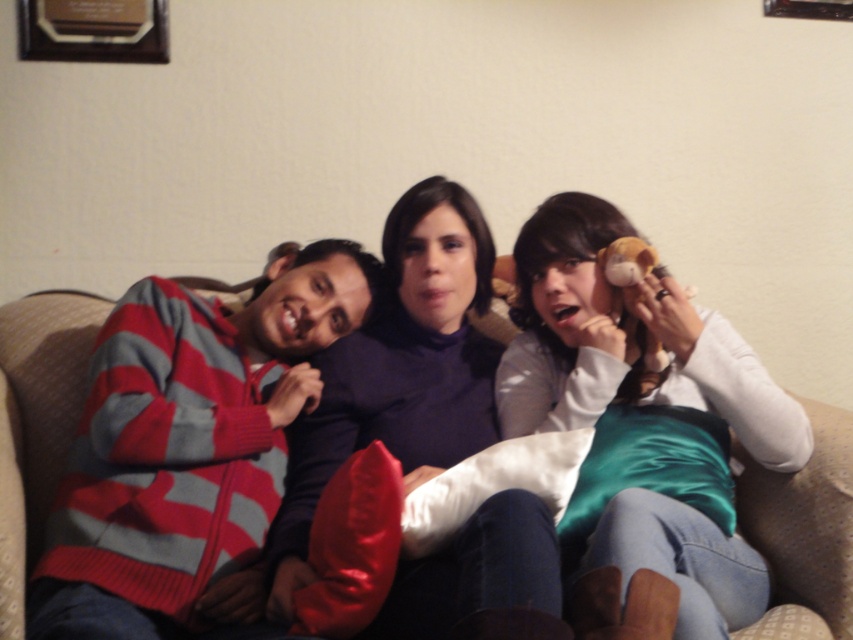
Question: Which object appears farthest from the camera in this image?

Choices:
 (A) matte purple sweater at center
 (B) white satin pillow at right
 (C) beige fabric couch at center

Answer: (C)

Question: Where is matte purple sweater at center located in relation to beige fabric couch at center in the image?

Choices:
 (A) right
 (B) left

Answer: (A)

Question: Which object is positioned farthest from the white satin pillow at right?

Choices:
 (A) matte purple sweater at center
 (B) striped knit sweater at left
 (C) beige fabric couch at center

Answer: (C)

Question: Can you confirm if white satin pillow at right is positioned above matte purple sweater at center?

Choices:
 (A) no
 (B) yes

Answer: (B)

Question: Which of the following is the farthest from the observer?

Choices:
 (A) striped knit sweater at left
 (B) matte purple sweater at center
 (C) white satin pillow at right
 (D) beige fabric couch at center

Answer: (D)

Question: Does matte purple sweater at center have a greater width compared to beige fabric couch at center?

Choices:
 (A) yes
 (B) no

Answer: (A)